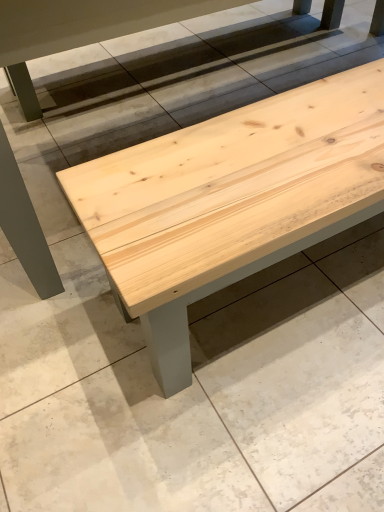
Find the location of `natural wood bench at center`. natural wood bench at center is located at coordinates (230, 200).

Measure the distance between point (348, 106) and camera.

The depth of point (348, 106) is 35.63 inches.

Describe the element at coordinates (230, 200) in the screenshot. Image resolution: width=384 pixels, height=512 pixels. I see `natural wood bench at center` at that location.

In order to face natural wood bench at center, should I rotate leftwards or rightwards?

Rotate your view right by about 15.234°.

Describe the element at coordinates (202, 392) in the screenshot. I see `natural wood bench at center` at that location.

What is the approximate height of natural wood bench at center?

natural wood bench at center is 2.40 inches tall.

Locate an element on the screen. This screenshot has width=384, height=512. natural wood bench at center is located at coordinates (202, 392).

This screenshot has width=384, height=512. I want to click on natural wood bench at center, so click(230, 200).

Considering the relative positions of natural wood bench at center and natural wood bench at center in the image provided, is natural wood bench at center to the left of natural wood bench at center from the viewer's perspective?

Yes.

Is the depth of natural wood bench at center greater than that of natural wood bench at center?

No, natural wood bench at center is in front of natural wood bench at center.

Considering the positions of points (190, 302) and (14, 318), is point (190, 302) closer to camera compared to point (14, 318)?

Yes, point (190, 302) is closer to viewer.

Consider the image. From the image's perspective, which is below, natural wood bench at center or natural wood bench at center?

natural wood bench at center is shown below in the image.

From a real-world perspective, does natural wood bench at center stand above natural wood bench at center?

Yes.

Which of these two, natural wood bench at center or natural wood bench at center, is thinner?

natural wood bench at center.

Between natural wood bench at center and natural wood bench at center, which one has more height?

With more height is natural wood bench at center.

Between natural wood bench at center and natural wood bench at center, which one has larger size?

With larger size is natural wood bench at center.

Is natural wood bench at center a part of natural wood bench at center?

No, natural wood bench at center is located outside of natural wood bench at center.

Can you see natural wood bench at center touching natural wood bench at center?

No, natural wood bench at center is not making contact with natural wood bench at center.

Is natural wood bench at center facing towards natural wood bench at center?

No.

Identify the location of table above the natural wood bench at center (from a real-world perspective). pos(230,200).

Is natural wood bench at center at the right side of natural wood bench at center?

Indeed, natural wood bench at center is positioned on the right side of natural wood bench at center.

Who is more distant, natural wood bench at center or natural wood bench at center?

natural wood bench at center is further from the camera.

Which is farther, (256, 324) or (99, 194)?

The point (256, 324) is farther from the camera.

From the image's perspective, which one is positioned higher, natural wood bench at center or natural wood bench at center?

natural wood bench at center appears higher in the image.

From a real-world perspective, is natural wood bench at center physically located above or below natural wood bench at center?

natural wood bench at center is below natural wood bench at center.

Considering the relative sizes of natural wood bench at center and natural wood bench at center in the image provided, is natural wood bench at center wider than natural wood bench at center?

Yes, natural wood bench at center is wider than natural wood bench at center.

Considering the sizes of objects natural wood bench at center and natural wood bench at center in the image provided, who is shorter, natural wood bench at center or natural wood bench at center?

With less height is natural wood bench at center.

Is natural wood bench at center bigger or smaller than natural wood bench at center?

Clearly, natural wood bench at center is smaller in size than natural wood bench at center.

Is natural wood bench at center not within natural wood bench at center?

Absolutely, natural wood bench at center is external to natural wood bench at center.

Does natural wood bench at center touch natural wood bench at center?

No, natural wood bench at center is not with natural wood bench at center.

Is natural wood bench at center turned away from natural wood bench at center?

No, natural wood bench at center is not at the back of natural wood bench at center.

How different are the orientations of natural wood bench at center and natural wood bench at center in degrees?

The facing directions of natural wood bench at center and natural wood bench at center are 179 degrees apart.

You are a GUI agent. You are given a task and a screenshot of the screen. Output one action in this format:
    pyautogui.click(x=<x>, y=<y>)
    Task: Click on the concrete below the natural wood bench at center (from a real-world perspective)
    This screenshot has height=512, width=384.
    Given the screenshot: What is the action you would take?
    pyautogui.click(x=202, y=392)

The image size is (384, 512). I want to click on table above the natural wood bench at center (from a real-world perspective), so click(230, 200).

The image size is (384, 512). I want to click on table that is above the natural wood bench at center (from the image's perspective), so click(x=230, y=200).